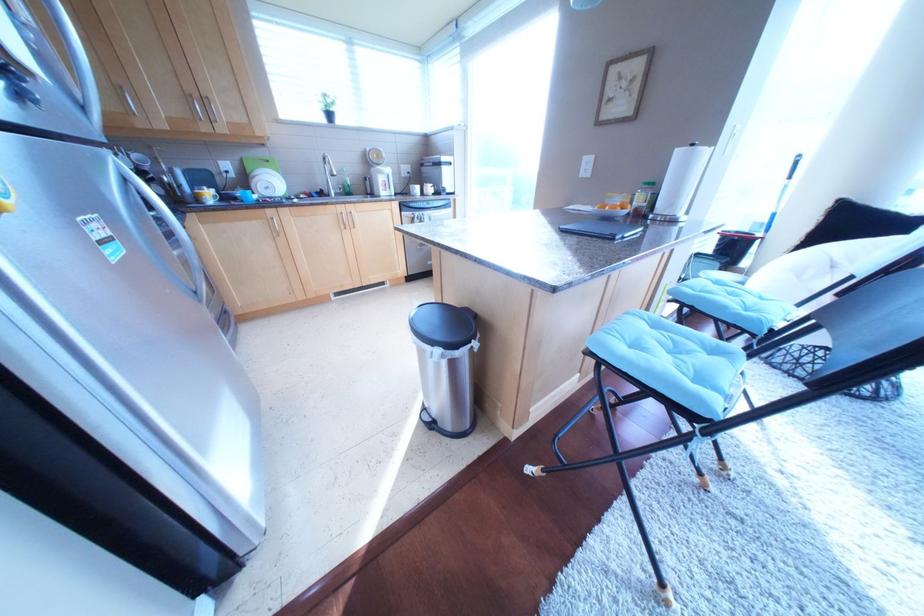
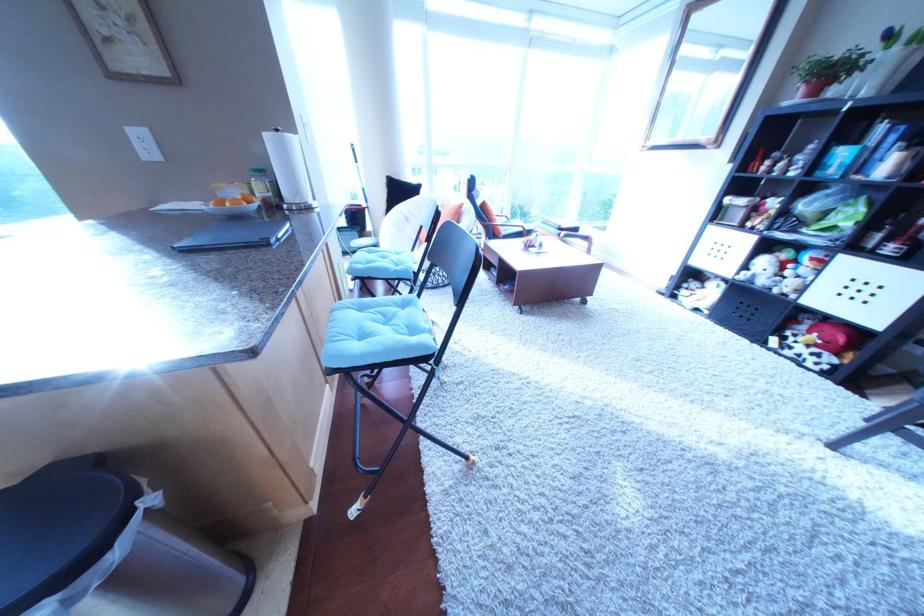
Based on the continuous images, in which direction is the camera rotating?

The rotation direction of the camera is right-down.